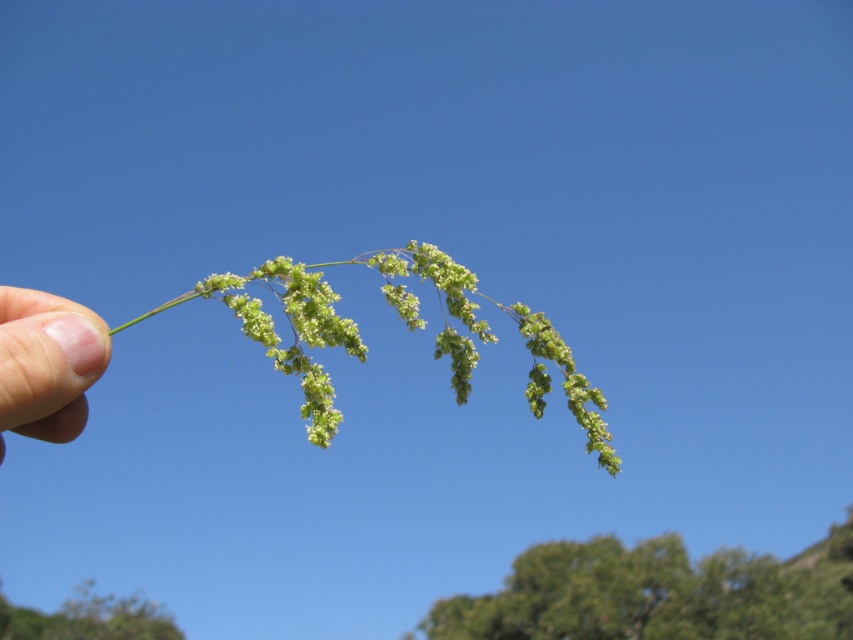
Question: Among these objects, which one is farthest from the camera?

Choices:
 (A) green fuzzy plant at lower left
 (B) green fuzzy plant at center

Answer: (A)

Question: Estimate the real-world distances between objects in this image. Which object is farther from the pink flesh at lower left?

Choices:
 (A) green fuzzy plant at lower left
 (B) green leafy tree at lower right

Answer: (A)

Question: Considering the relative positions of green leafy tree at lower right and green fuzzy plant at center in the image provided, where is green leafy tree at lower right located with respect to green fuzzy plant at center?

Choices:
 (A) right
 (B) left

Answer: (A)

Question: Does green leafy tree at lower right come in front of green fuzzy plant at center?

Choices:
 (A) no
 (B) yes

Answer: (A)

Question: Which of the following is the closest to the observer?

Choices:
 (A) pink flesh at lower left
 (B) green fuzzy plant at lower left
 (C) green fuzzy plant at center

Answer: (A)

Question: Can you confirm if green fuzzy plant at center is positioned to the left of pink flesh at lower left?

Choices:
 (A) no
 (B) yes

Answer: (A)